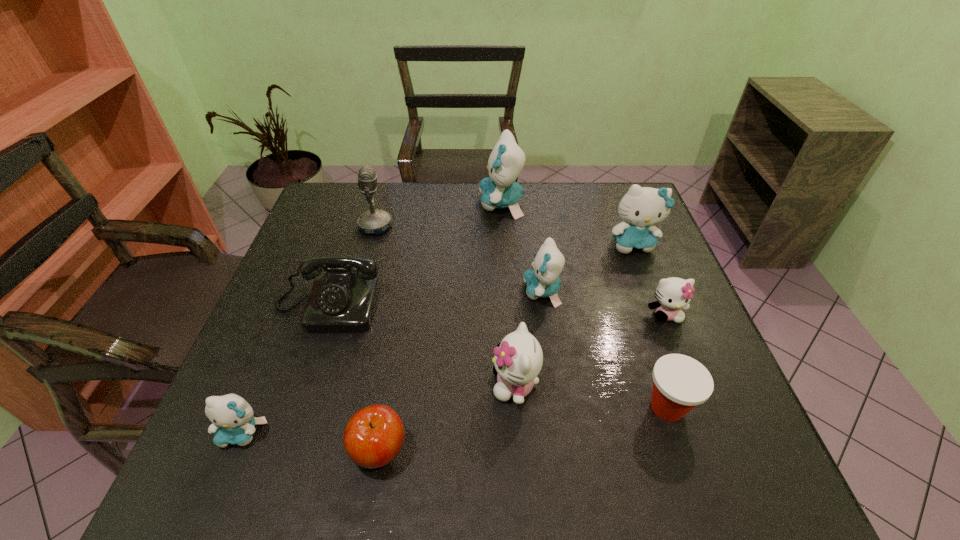
The height and width of the screenshot is (540, 960). What are the coordinates of `kitten that is positioned at the far edge` in the screenshot? It's located at 499,190.

The width and height of the screenshot is (960, 540). I want to click on microphone located in the far edge section of the desktop, so click(374, 221).

Where is `kitten present at the near edge`? This screenshot has width=960, height=540. kitten present at the near edge is located at coordinates (233, 422).

Image resolution: width=960 pixels, height=540 pixels. I want to click on apple that is at the near edge, so click(x=373, y=437).

Identify the location of microphone that is at the left edge. coord(374,221).

Locate an element on the screen. The width and height of the screenshot is (960, 540). telephone that is at the left edge is located at coordinates (343, 300).

Image resolution: width=960 pixels, height=540 pixels. In order to click on kitten that is positioned at the left edge in this screenshot , I will do `click(233, 422)`.

I want to click on Dixie cup present at the right edge, so click(x=680, y=383).

The width and height of the screenshot is (960, 540). Find the location of `object that is at the far left corner`. object that is at the far left corner is located at coordinates (374, 221).

Where is `object located at the near left corner`? The height and width of the screenshot is (540, 960). object located at the near left corner is located at coordinates (233, 422).